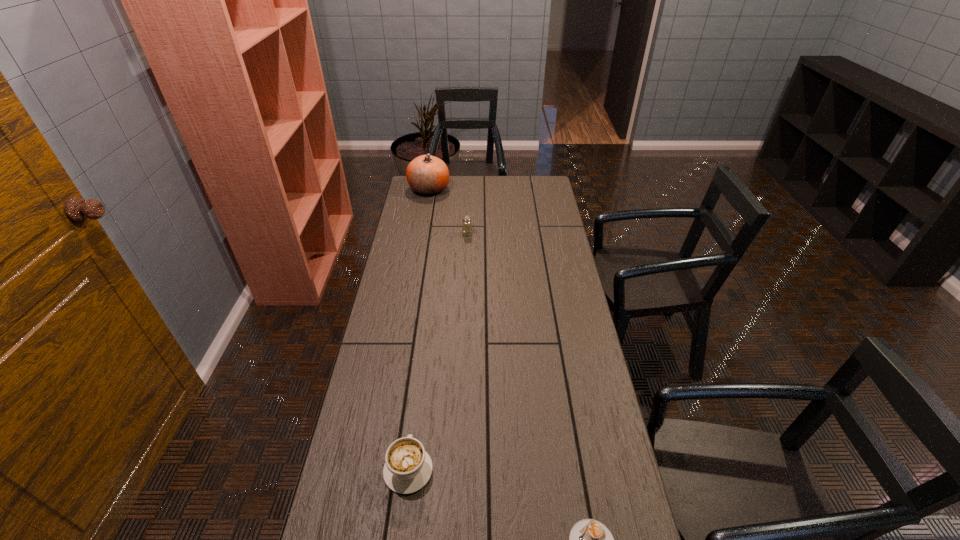
Find the location of `vacant region located to the right of the second nearest object's handle`. vacant region located to the right of the second nearest object's handle is located at coordinates (418, 392).

I want to click on object that is at the far edge, so click(x=428, y=175).

Where is `pumpkin positioned at the left edge`? The image size is (960, 540). pumpkin positioned at the left edge is located at coordinates (428, 175).

Locate an element on the screen. cappuccino that is at the left edge is located at coordinates (408, 467).

The height and width of the screenshot is (540, 960). I want to click on object at the far left corner, so click(x=428, y=175).

I want to click on blank space at the far edge, so click(513, 179).

You are a GUI agent. You are given a task and a screenshot of the screen. Output one action in this format:
    pyautogui.click(x=<x>, y=<y>)
    Task: Click on the vacant region at the left edge of the desktop
    The height and width of the screenshot is (540, 960).
    Given the screenshot: What is the action you would take?
    pyautogui.click(x=418, y=279)

Find the location of a particular element. The image size is (960, 540). free spot at the right edge of the desktop is located at coordinates (559, 291).

You are a GUI agent. You are given a task and a screenshot of the screen. Output one action in this format:
    pyautogui.click(x=<x>, y=<y>)
    Task: Click on the vacant area at the far right corner of the desktop
    
    Given the screenshot: What is the action you would take?
    pyautogui.click(x=536, y=184)

Where is `free area in between the tallest object and the third nearest object`? free area in between the tallest object and the third nearest object is located at coordinates (448, 211).